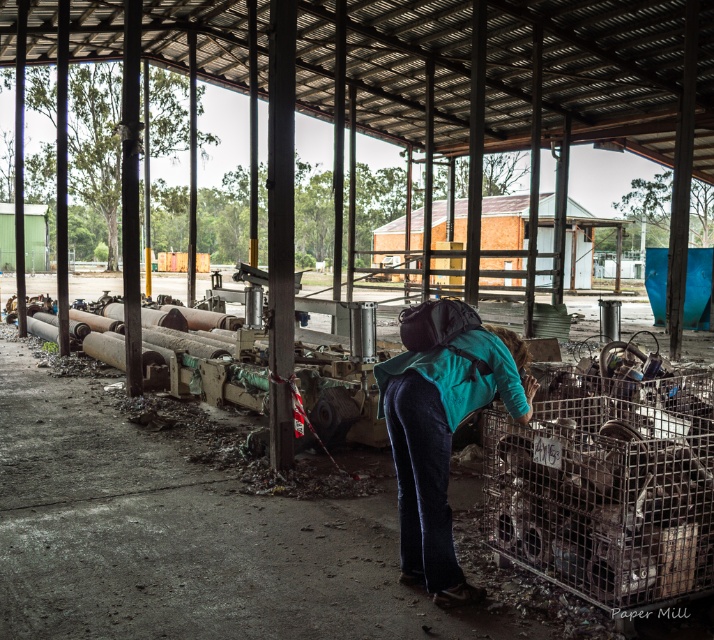
Question: Is teal fabric backpack at center smaller than brown wooden hut at center?

Choices:
 (A) no
 (B) yes

Answer: (B)

Question: Which point is farther from the camera taking this photo?

Choices:
 (A) (620, 225)
 (B) (451, 518)

Answer: (A)

Question: Does teal fabric backpack at center have a smaller size compared to brown wooden hut at center?

Choices:
 (A) yes
 (B) no

Answer: (A)

Question: Is teal fabric backpack at center bigger than brown wooden hut at center?

Choices:
 (A) yes
 (B) no

Answer: (B)